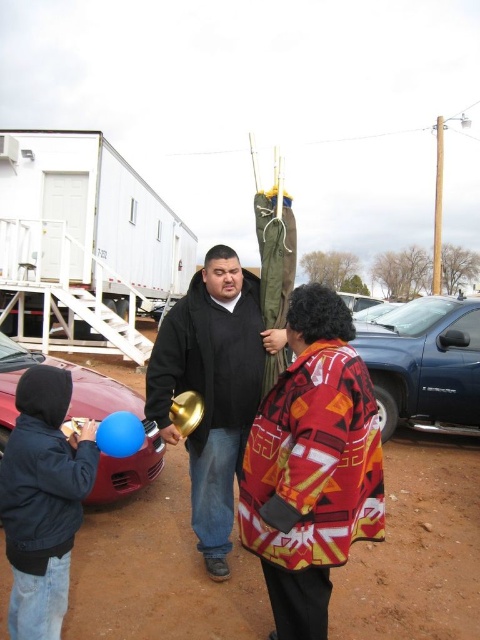
You are a photographer trying to capture a photo of the navy blue jacket at lower left and the blue metallic truck at lower right. Based on their positions, which object will appear larger in the photo?

The navy blue jacket at lower left is closer to the viewer than the blue metallic truck at lower right, so it will appear larger in the photo.

You are a photographer trying to capture a photo of the navy blue jacket at lower left and the blue metallic truck at lower right. Which object should you focus on first if you want to include both in your shot without moving the camera?

You should focus on the navy blue jacket at lower left first because it is closer to you than the blue metallic truck at lower right, allowing both to be in frame without moving the camera.

You are a photographer trying to capture the black matte jacket at center and the shiny red car at lower left in the same frame. Can you position yourself so that both are visible without any obstruction?

The black matte jacket at center is positioned over the shiny red car at lower left, so if you position yourself to see the shiny red car at lower left, the black matte jacket at center might block the view. Adjust your angle to ensure both are visible without overlap.